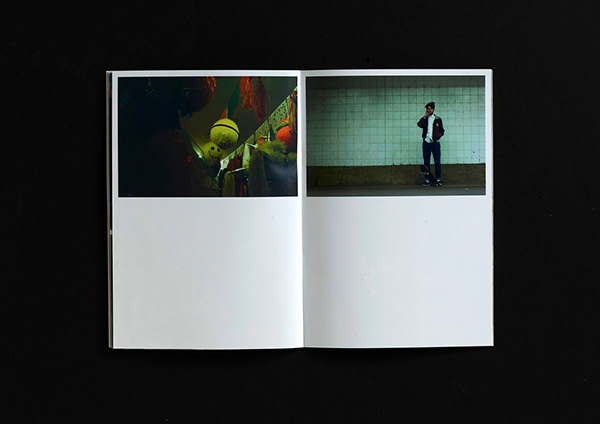
Image resolution: width=600 pixels, height=424 pixels. In order to click on pictures in this screenshot , I will do `click(197, 155)`, `click(418, 165)`.